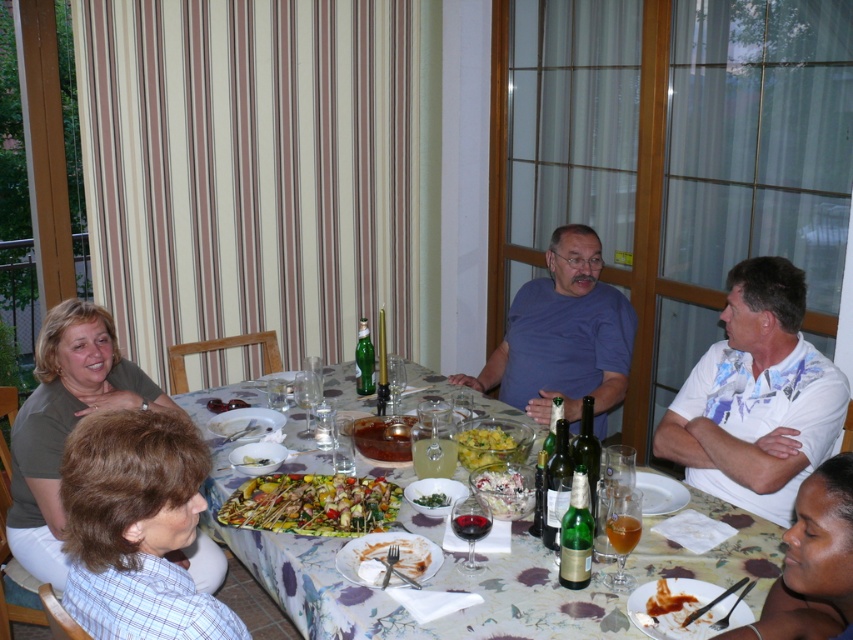
Which is below, thick brown sauce at lower right or yellowish matte skewers at center?

thick brown sauce at lower right is below.

Which is more to the right, thick brown sauce at lower right or yellowish matte skewers at center?

thick brown sauce at lower right is more to the right.

At what (x,y) coordinates should I click in order to perform the action: click on thick brown sauce at lower right. Please return your answer as a coordinate pair (x, y). Looking at the image, I should click on [665, 600].

Based on the photo, does dark brown skin at lower right lie behind yellowish matte skewers at center?

No, it is not.

The height and width of the screenshot is (640, 853). I want to click on dark brown skin at lower right, so click(811, 563).

Can you confirm if wooden table at center is positioned to the right of dark brown skin at lower right?

Incorrect, wooden table at center is not on the right side of dark brown skin at lower right.

Does wooden table at center appear under dark brown skin at lower right?

Yes.

The height and width of the screenshot is (640, 853). I want to click on wooden table at center, so click(390, 600).

The width and height of the screenshot is (853, 640). What are the coordinates of `wooden table at center` in the screenshot? It's located at (390, 600).